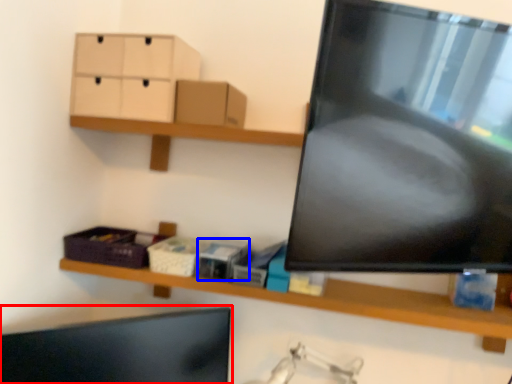
Question: Which point is further to the camera, computer monitor (highlighted by a red box) or storage box (highlighted by a blue box)?

Choices:
 (A) computer monitor
 (B) storage box

Answer: (B)